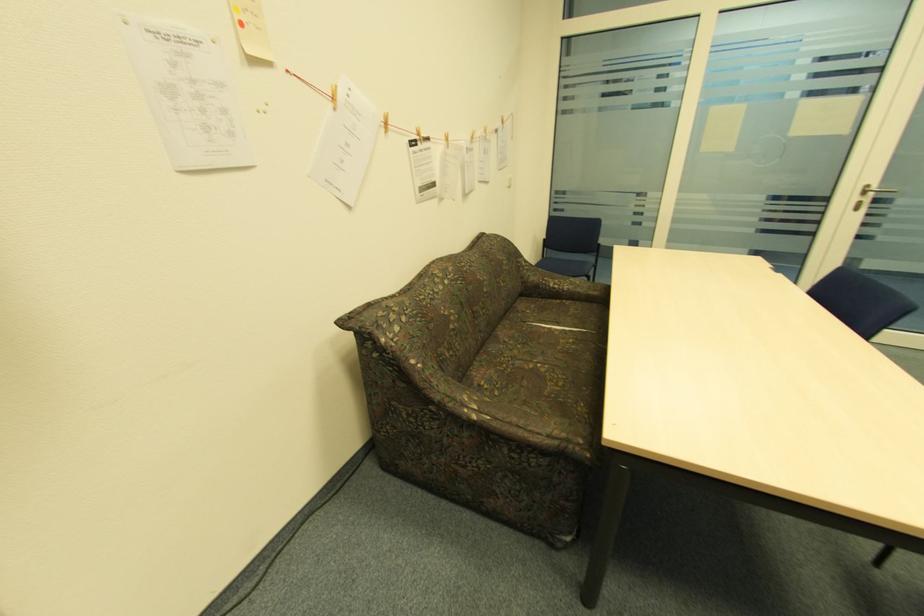
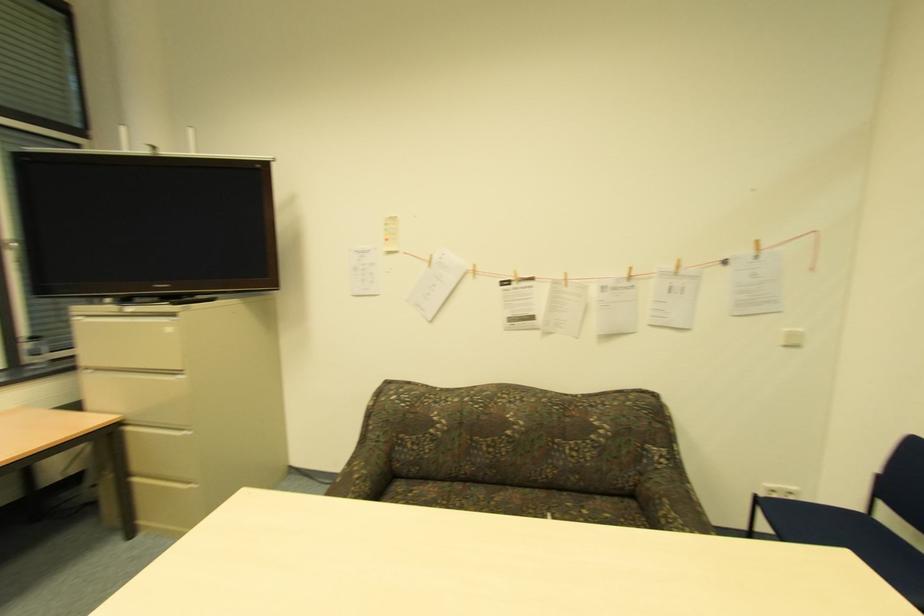
The point at (x=514, y=180) is marked in the first image. Where is the corresponding point in the second image?

(792, 334)